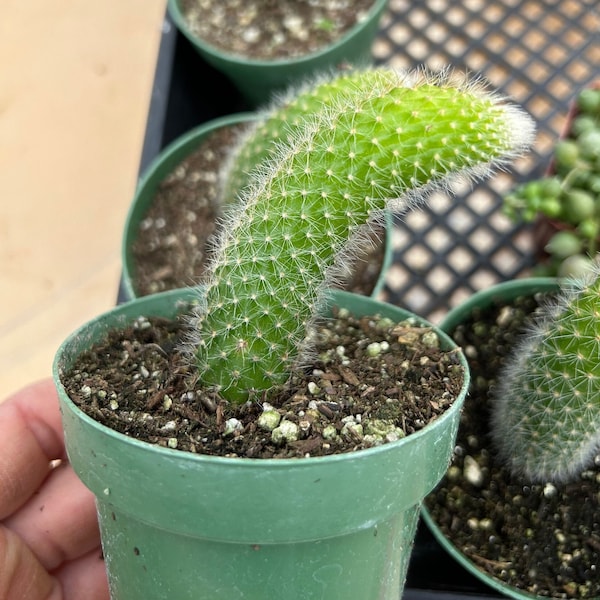
I want to click on plant, so tap(257, 331).